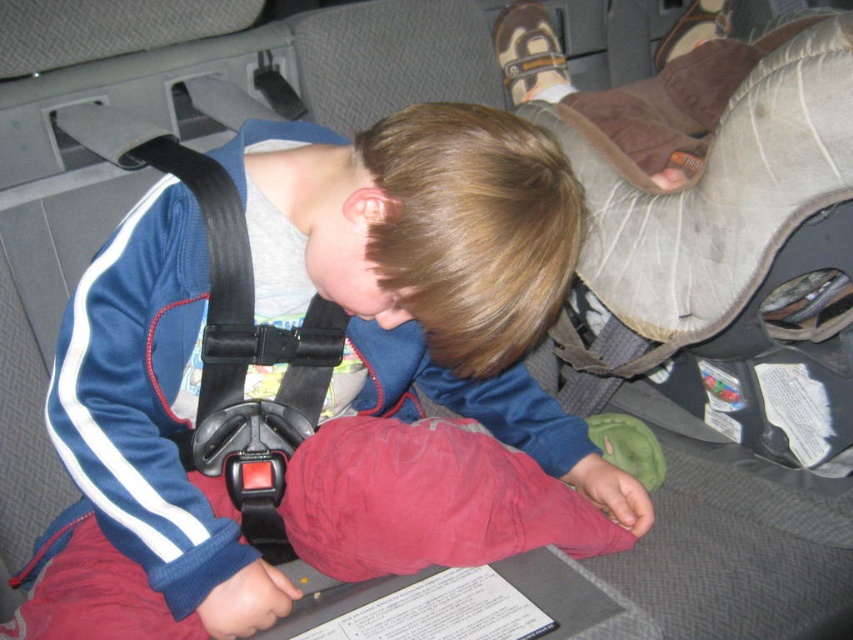
You are a safety inspector checking the car seat setup. You notice the matte blue jacket at center and the black plastic seatbelt at center. According to safety guidelines, the seatbelt should be snug against the child without any bulky items like thick jackets interfering. Does the current setup comply with safety standards?

The matte blue jacket at center is wider than the black plastic seatbelt at center, which means the jacket may prevent the seatbelt from fitting snugly. This setup does not comply with safety standards as the jacket could interfere with proper seatbelt function.

You are a safety inspector checking the car seat. You notice the matte blue jacket at center and the black plastic seatbelt at center. Which object is shorter in height?

The matte blue jacket at center is not as tall as the black plastic seatbelt at center, so the matte blue jacket at center is shorter in height.

You are a safety inspector checking the car seat installation. You need to ensure that the distance from the camera to the point marked at coordinates point (466, 352) is within the recommended 30 inches. Is the distance compliant?

The distance between the camera and point (466, 352) is 32.83 inches, which exceeds the recommended 30 inches. Therefore, the installation does not comply with the safety standard.